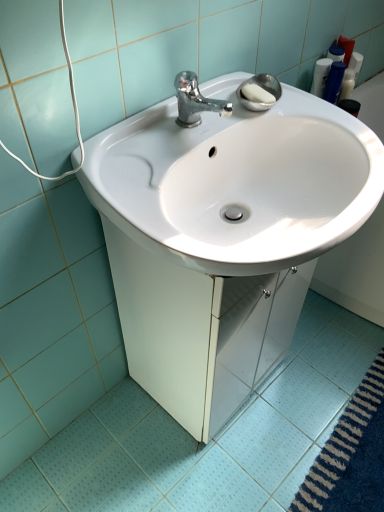
Question: From a real-world perspective, is chrome metallic faucet at upper center located beneath white glossy sink at center?

Choices:
 (A) no
 (B) yes

Answer: (A)

Question: Is chrome metallic faucet at upper center aimed at white glossy sink at center?

Choices:
 (A) yes
 (B) no

Answer: (B)

Question: Can you confirm if chrome metallic faucet at upper center is taller than white glossy sink at center?

Choices:
 (A) yes
 (B) no

Answer: (B)

Question: From the image's perspective, is chrome metallic faucet at upper center below white glossy sink at center?

Choices:
 (A) yes
 (B) no

Answer: (B)

Question: Would you say white glossy sink at center is part of chrome metallic faucet at upper center's contents?

Choices:
 (A) yes
 (B) no

Answer: (B)

Question: Is chrome metallic faucet at upper center inside or outside of white glossy sink at center?

Choices:
 (A) inside
 (B) outside

Answer: (B)

Question: Considering the positions of chrome metallic faucet at upper center and white glossy sink at center in the image, is chrome metallic faucet at upper center wider or thinner than white glossy sink at center?

Choices:
 (A) wide
 (B) thin

Answer: (B)

Question: In the image, is chrome metallic faucet at upper center on the left side or the right side of white glossy sink at center?

Choices:
 (A) right
 (B) left

Answer: (B)

Question: From a real-world perspective, is chrome metallic faucet at upper center above or below white glossy sink at center?

Choices:
 (A) above
 (B) below

Answer: (A)

Question: In the image, is white glossy sink at center positioned in front of or behind chrome metallic faucet at upper center?

Choices:
 (A) behind
 (B) front

Answer: (B)

Question: From the image's perspective, is white glossy sink at center positioned above or below chrome metallic faucet at upper center?

Choices:
 (A) below
 (B) above

Answer: (A)

Question: In terms of size, does white glossy sink at center appear bigger or smaller than chrome metallic faucet at upper center?

Choices:
 (A) small
 (B) big

Answer: (B)

Question: Is white glossy sink at center inside or outside of chrome metallic faucet at upper center?

Choices:
 (A) outside
 (B) inside

Answer: (A)

Question: From the image's perspective, relative to white glossy sink at center, is white glossy sink at center above or below?

Choices:
 (A) above
 (B) below

Answer: (B)

Question: Would you say white glossy sink at center is to the left or to the right of white glossy sink at center in the picture?

Choices:
 (A) right
 (B) left

Answer: (B)